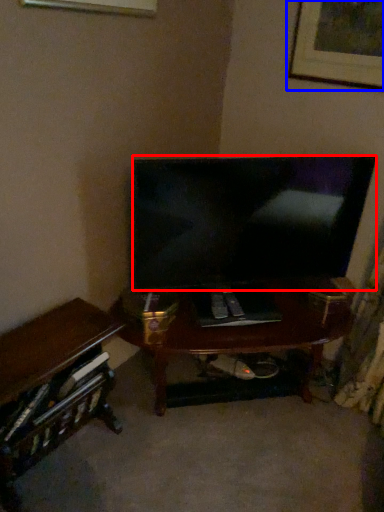
Question: Which of the following is the closest to the observer, television (highlighted by a red box) or picture frame (highlighted by a blue box)?

Choices:
 (A) television
 (B) picture frame

Answer: (A)